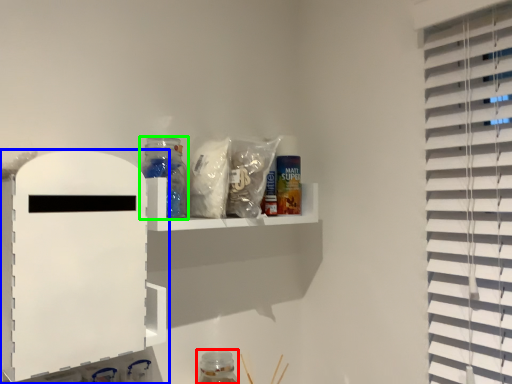
Question: Based on their relative distances, which object is nearer to bottle (highlighted by a red box)? Choose from shelf (highlighted by a blue box) and bottle (highlighted by a green box).

Choices:
 (A) shelf
 (B) bottle

Answer: (B)